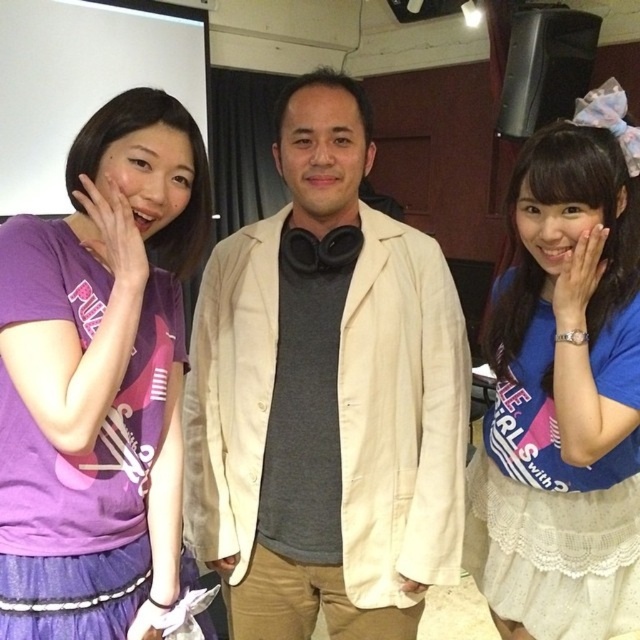
Between beige fabric jacket at center and blue fabric shirt at center, which one appears on the left side from the viewer's perspective?

From the viewer's perspective, beige fabric jacket at center appears more on the left side.

Who is more distant from viewer, (246, 472) or (577, 580)?

Point (577, 580)

This screenshot has height=640, width=640. What are the coordinates of `beige fabric jacket at center` in the screenshot? It's located at (326, 400).

Is point (65, 365) more distant than point (550, 532)?

No.

Is point (124, 276) positioned in front of point (513, 216)?

Yes, it is in front of point (513, 216).

You are a GUI agent. You are given a task and a screenshot of the screen. Output one action in this format:
    pyautogui.click(x=<x>, y=<y>)
    Task: Click on the purple matte t-shirt at left
    The height and width of the screenshot is (640, 640).
    Given the screenshot: What is the action you would take?
    pyautogui.click(x=99, y=364)

From the picture: Between beige fabric jacket at center and purple matte t-shirt at left, which one has less height?

purple matte t-shirt at left

Is beige fabric jacket at center bigger than purple matte t-shirt at left?

Correct, beige fabric jacket at center is larger in size than purple matte t-shirt at left.

Identify the location of beige fabric jacket at center. The height and width of the screenshot is (640, 640). (326, 400).